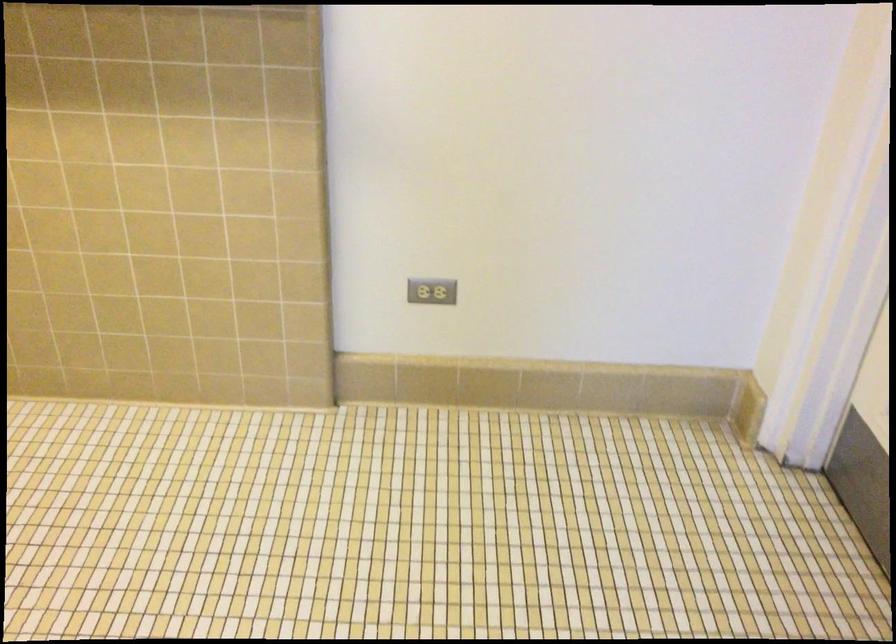
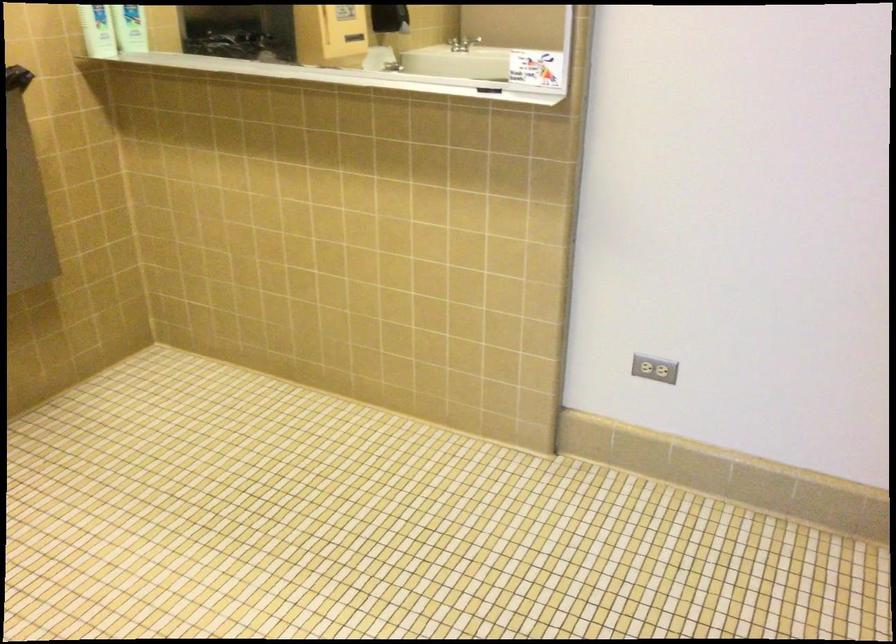
In a continuous first-person perspective shot, in which direction is the camera moving?

The cameraman moved toward right, backward.